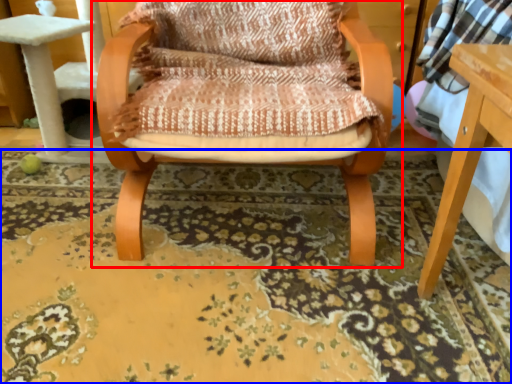
Question: Which point is closer to the camera, chair (highlighted by a red box) or mat (highlighted by a blue box)?

Choices:
 (A) chair
 (B) mat

Answer: (A)